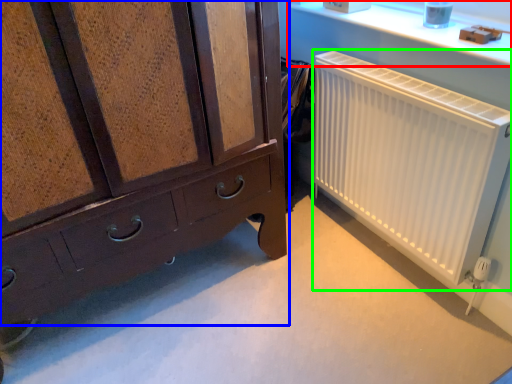
Question: Which object is the farthest from window sill (highlighted by a red box)? Choose among these: chest of drawers (highlighted by a blue box) or radiator (highlighted by a green box).

Choices:
 (A) chest of drawers
 (B) radiator

Answer: (A)